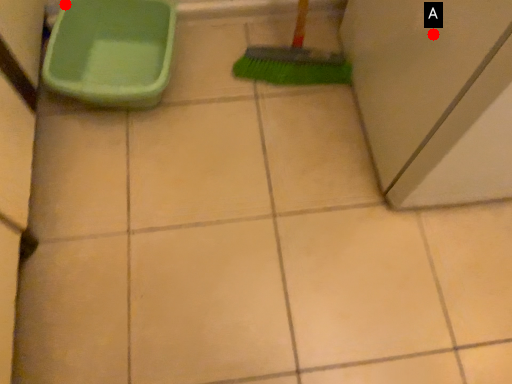
Question: Two points are circled on the image, labeled by A and B beside each circle. Which point is farther to the camera?

Choices:
 (A) A is further
 (B) B is further

Answer: (B)